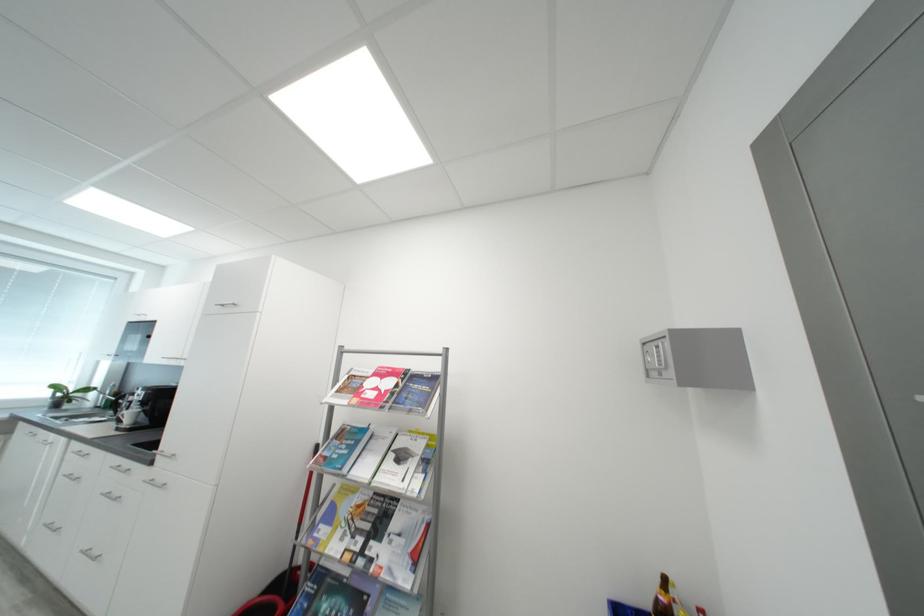
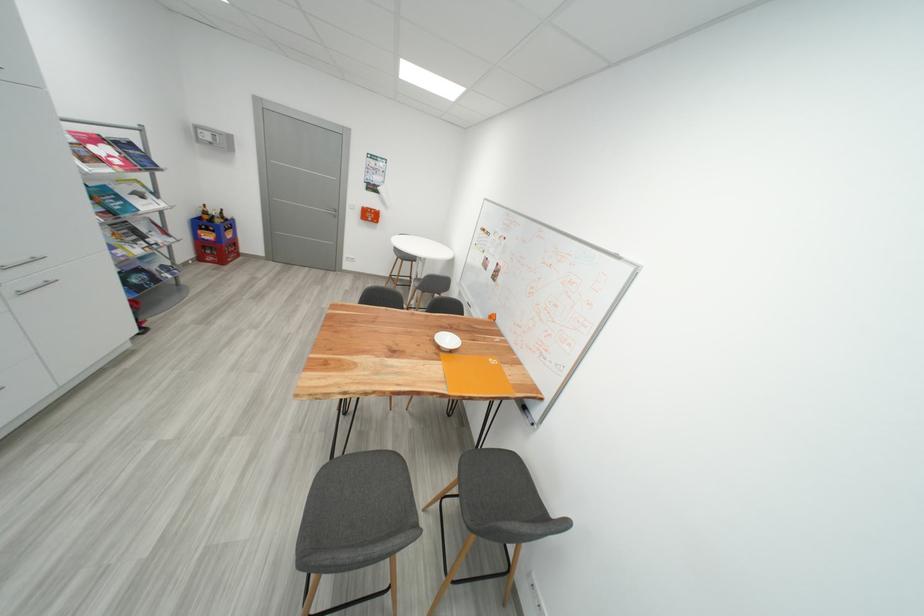
Where in the second image is the point corresponding to [355,448] from the first image?

(122, 201)